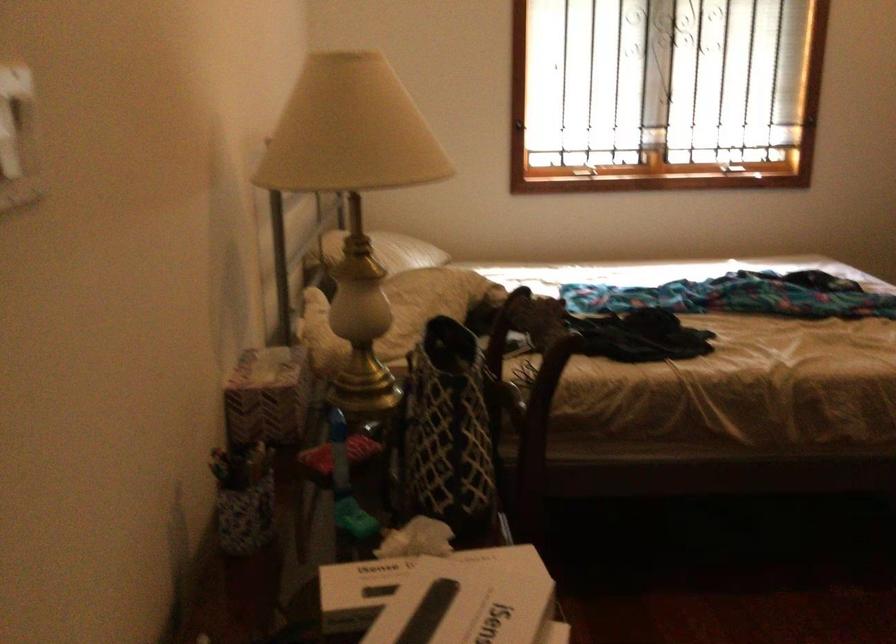
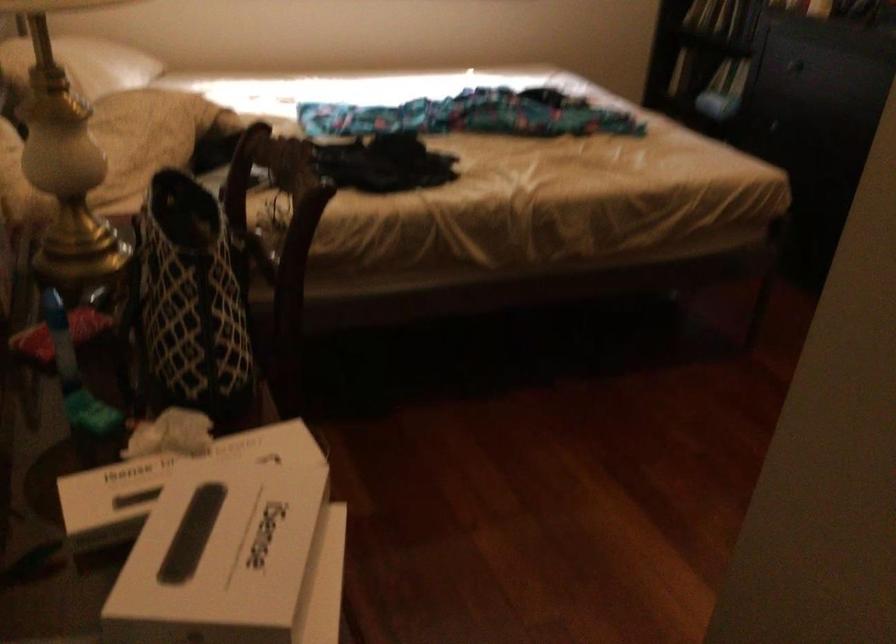
Locate, in the second image, the point that corresponds to (x=391, y=252) in the first image.

(82, 64)